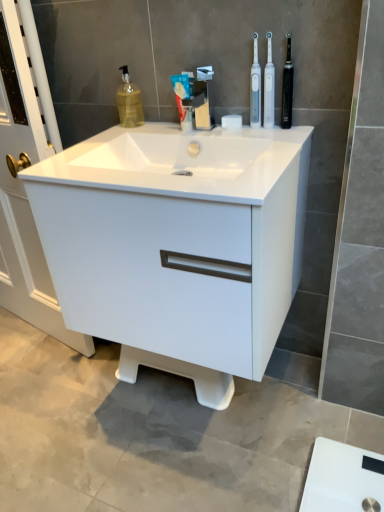
You are a GUI agent. You are given a task and a screenshot of the screen. Output one action in this format:
    pyautogui.click(x=<x>, y=<y>)
    Task: Click on the free spot to the left of white plastic toothbrush at upper right, the second toothbrush positioned from the right
    The image size is (384, 512).
    Given the screenshot: What is the action you would take?
    pyautogui.click(x=213, y=129)